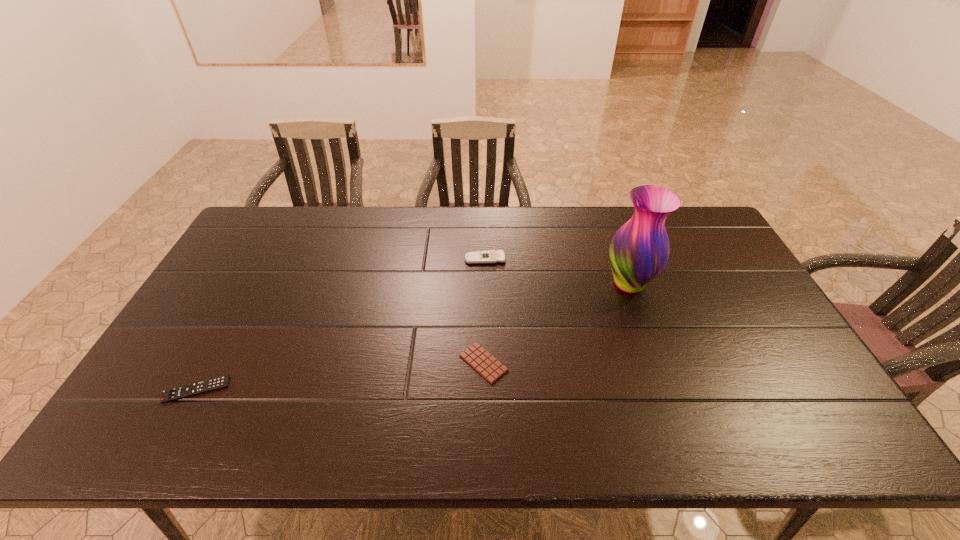
Identify the location of free location located on the right of the shortest object. (605, 363).

The image size is (960, 540). What are the coordinates of `object located at the left edge` in the screenshot? It's located at (184, 391).

Find the location of `vacant area at the far edge of the desktop`. vacant area at the far edge of the desktop is located at coordinates (387, 239).

Find the location of a particular element. This screenshot has width=960, height=540. free space at the near edge is located at coordinates (598, 420).

Identify the location of vacant space at the left edge of the desktop. The image size is (960, 540). (244, 281).

Where is `free location at the right edge of the desktop`? free location at the right edge of the desktop is located at coordinates (717, 265).

In the image, there is a desktop. Where is `vacant space at the near right corner`? The width and height of the screenshot is (960, 540). vacant space at the near right corner is located at coordinates (774, 436).

The width and height of the screenshot is (960, 540). I want to click on empty location between the left remote control and the candy bar, so click(340, 376).

The width and height of the screenshot is (960, 540). I want to click on vacant point located between the tallest object and the shortest object, so click(x=556, y=323).

Where is `vacant space in between the left remote control and the shortest object`? vacant space in between the left remote control and the shortest object is located at coordinates (340, 376).